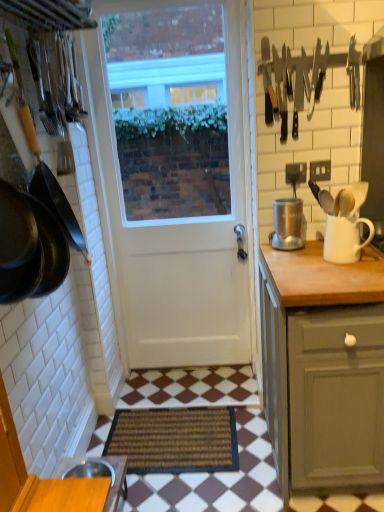
This screenshot has height=512, width=384. What are the coordinates of `vacant space to the left of matte gray cabinet at right` in the screenshot? It's located at pos(238,473).